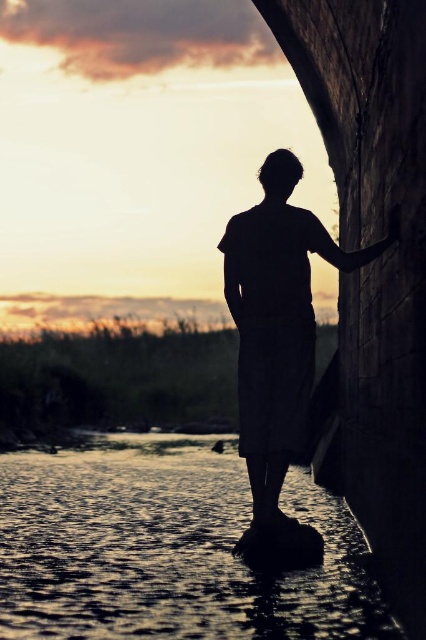
Question: Which of the following is the farthest from the observer?

Choices:
 (A) (247, 396)
 (B) (310, 611)

Answer: (A)

Question: Among these points, which one is farthest from the camera?

Choices:
 (A) (195, 589)
 (B) (273, 188)

Answer: (B)

Question: Is shiny reflective water at lower center bigger than silhouette fabric at center?

Choices:
 (A) no
 (B) yes

Answer: (B)

Question: Can you confirm if shiny reflective water at lower center is bigger than silhouette fabric at center?

Choices:
 (A) yes
 (B) no

Answer: (A)

Question: Can you confirm if shiny reflective water at lower center is positioned to the right of silhouette fabric at center?

Choices:
 (A) no
 (B) yes

Answer: (A)